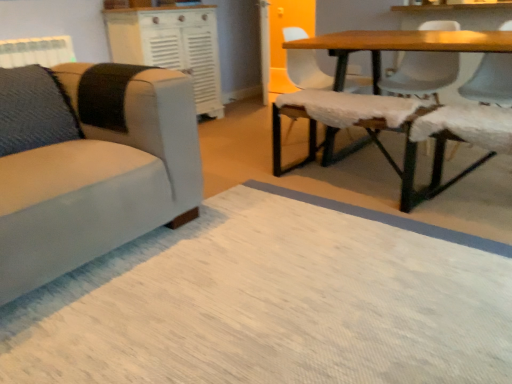
What is the approximate width of white textured radiator at upper left?

6.09 inches.

The height and width of the screenshot is (384, 512). Describe the element at coordinates (455, 140) in the screenshot. I see `fur-covered bench at lower right` at that location.

At what (x,y) coordinates should I click in order to perform the action: click on white textured cabinet at upper center. Please return your answer as a coordinate pair (x, y). Looking at the image, I should click on (170, 46).

Describe the element at coordinates (170, 46) in the screenshot. I see `white textured cabinet at upper center` at that location.

Measure the distance between wooden bench at right and camera.

The depth of wooden bench at right is 1.70 meters.

You are a GUI agent. You are given a task and a screenshot of the screen. Output one action in this format:
    pyautogui.click(x=<x>, y=<y>)
    Task: Click on the suede beige chair at left, marked as the first chair in a left-to-right arrangement
    Image resolution: width=512 pixels, height=384 pixels.
    Given the screenshot: What is the action you would take?
    pyautogui.click(x=90, y=164)

Locate an element on the screen. The height and width of the screenshot is (384, 512). smooth white chair at upper right, which is the 5th chair in left-to-right order is located at coordinates (490, 81).

This screenshot has width=512, height=384. In order to click on white textured radiator at upper left in this screenshot , I will do `click(36, 51)`.

Is white textured bench at right, which is the 3th chair in right-to-left order, positioned with its back to suede beige chair at left, placed as the 5th chair when sorted from right to left?

No.

From a real-world perspective, between white textured bench at right, which is the 3th chair in right-to-left order, and suede beige chair at left, placed as the 5th chair when sorted from right to left, who is vertically lower?

suede beige chair at left, placed as the 5th chair when sorted from right to left, from a real-world perspective.

Is white textured bench at right, which is the 3th chair in right-to-left order, bigger than suede beige chair at left, placed as the 5th chair when sorted from right to left?

No.

In order to click on chair on the left of white fabric chair at upper right, which is the 4th chair from right to left in this screenshot , I will do `click(90, 164)`.

From a real-world perspective, does suede beige chair at left, marked as the first chair in a left-to-right arrangement, stand above white fabric chair at upper right, which is the 4th chair from right to left?

Actually, suede beige chair at left, marked as the first chair in a left-to-right arrangement, is physically below white fabric chair at upper right, which is the 4th chair from right to left, in the real world.

Is suede beige chair at left, placed as the 5th chair when sorted from right to left, bigger than white fabric chair at upper right, which is the 4th chair from right to left?

Yes, suede beige chair at left, placed as the 5th chair when sorted from right to left, is bigger than white fabric chair at upper right, which is the 4th chair from right to left.

Between white textured bench at right, which is the 3th chair in right-to-left order, and fur-covered bench at lower right, which one has larger width?

Wider between the two is white textured bench at right, which is the 3th chair in right-to-left order.

Is fur-covered bench at lower right surrounded by white textured bench at right, placed as the 3th chair when sorted from left to right?

No, fur-covered bench at lower right is located outside of white textured bench at right, placed as the 3th chair when sorted from left to right.

Which is closer to the camera, [451,113] or [406,141]?

Positioned in front is point [406,141].

From a real-world perspective, relative to fur-covered bench at lower right, is white textured bench at right, placed as the 3th chair when sorted from left to right, vertically above or below?

In terms of real-world spatial position, white textured bench at right, placed as the 3th chair when sorted from left to right, is above fur-covered bench at lower right.

Considering the sizes of objects wooden bench at right and white textured bench at right, which is the 3th chair in right-to-left order, in the image provided, who is bigger, wooden bench at right or white textured bench at right, which is the 3th chair in right-to-left order,?

wooden bench at right is bigger.

Find the location of `the 4th chair above the wooden bench at right (from a real-world perspective)`. the 4th chair above the wooden bench at right (from a real-world perspective) is located at coordinates (478, 108).

Which is further, (473,116) or (484,55)?

The point (484,55) is behind.

Find the location of a particular element. This screenshot has height=384, width=512. radiator that is above the suede beige chair at left, marked as the first chair in a left-to-right arrangement (from a real-world perspective) is located at coordinates (36, 51).

From a real-world perspective, is white textured radiator at upper left physically located above or below suede beige chair at left, placed as the 5th chair when sorted from right to left?

Clearly, from a real-world perspective, white textured radiator at upper left is above suede beige chair at left, placed as the 5th chair when sorted from right to left.

Considering the relative sizes of white textured radiator at upper left and suede beige chair at left, placed as the 5th chair when sorted from right to left, in the image provided, is white textured radiator at upper left wider than suede beige chair at left, placed as the 5th chair when sorted from right to left,?

No, white textured radiator at upper left is not wider than suede beige chair at left, placed as the 5th chair when sorted from right to left.

In terms of width, does white textured cabinet at upper center look wider or thinner when compared to wooden bench at right?

Considering their sizes, white textured cabinet at upper center looks slimmer than wooden bench at right.

From a real-world perspective, is white textured cabinet at upper center positioned above or below wooden bench at right?

white textured cabinet at upper center is above wooden bench at right.

This screenshot has width=512, height=384. I want to click on dresser on the left of wooden bench at right, so click(x=170, y=46).

From a real-world perspective, is fuzzy fabric swivel chair at center over suede beige chair at left, placed as the 5th chair when sorted from right to left?

Actually, fuzzy fabric swivel chair at center is physically below suede beige chair at left, placed as the 5th chair when sorted from right to left, in the real world.

Would you say fuzzy fabric swivel chair at center contains suede beige chair at left, marked as the first chair in a left-to-right arrangement?

No, suede beige chair at left, marked as the first chair in a left-to-right arrangement, is not inside fuzzy fabric swivel chair at center.

Where is `swivel chair lying behind the suede beige chair at left, placed as the 5th chair when sorted from right to left`? This screenshot has height=384, width=512. swivel chair lying behind the suede beige chair at left, placed as the 5th chair when sorted from right to left is located at coordinates (331, 116).

Find the location of a particular element. This screenshot has height=384, width=512. the 2nd chair counting from the right side of the suede beige chair at left, placed as the 5th chair when sorted from right to left is located at coordinates (478, 108).

In order to click on chair that is the 2nd object above the suede beige chair at left, marked as the first chair in a left-to-right arrangement (from a real-world perspective) in this screenshot , I will do `click(306, 70)`.

From the image, which object appears to be nearer to white fabric chair at upper right, the second chair positioned from the right, white fabric chair at upper right, which is the 4th chair from right to left, or white textured cabinet at upper center?

Among the two, white fabric chair at upper right, which is the 4th chair from right to left, is located nearer to white fabric chair at upper right, the second chair positioned from the right.

Considering their positions, is white textured bench at right, placed as the 3th chair when sorted from left to right, positioned closer to white fabric chair at upper right, the second chair positioned from the right, than white textured cabinet at upper center?

Among the two, white textured bench at right, placed as the 3th chair when sorted from left to right, is located nearer to white fabric chair at upper right, the second chair positioned from the right.

When comparing their distances from fuzzy fabric swivel chair at center, does white textured cabinet at upper center or wooden bench at right seem further?

white textured cabinet at upper center lies further to fuzzy fabric swivel chair at center than the other object.

Based on the photo, estimate the real-world distances between objects in this image. Which object is closer to white textured bench at right, placed as the 3th chair when sorted from left to right, white textured radiator at upper left or wooden bench at right?

Based on the image, wooden bench at right appears to be nearer to white textured bench at right, placed as the 3th chair when sorted from left to right.

When comparing their distances from white fabric chair at upper right, which is the 4th chair from right to left, does white textured cabinet at upper center or fur-covered bench at lower right seem further?

fur-covered bench at lower right is positioned further to the anchor white fabric chair at upper right, which is the 4th chair from right to left.

Which object lies nearer to the anchor point fur-covered bench at lower right, smooth white chair at upper right, which is the 5th chair in left-to-right order, or white textured cabinet at upper center?

Based on the image, smooth white chair at upper right, which is the 5th chair in left-to-right order, appears to be nearer to fur-covered bench at lower right.

Based on their spatial positions, is white textured cabinet at upper center or fuzzy fabric swivel chair at center closer to white fabric chair at upper right, which is the 4th chair from right to left?

The object closer to white fabric chair at upper right, which is the 4th chair from right to left, is fuzzy fabric swivel chair at center.

From the image, which object appears to be farther from white fabric chair at upper right, the fourth chair from the left, wooden bench at right or white fabric chair at upper right, which appears as the 2th chair when viewed from the left?

wooden bench at right is further to white fabric chair at upper right, the fourth chair from the left.

At what (x,y) coordinates should I click in order to perform the action: click on swivel chair between white textured cabinet at upper center and fur-covered bench at lower right in the horizontal direction. Please return your answer as a coordinate pair (x, y). This screenshot has width=512, height=384. Looking at the image, I should click on (331, 116).

The width and height of the screenshot is (512, 384). I want to click on chair between fuzzy fabric swivel chair at center and fur-covered bench at lower right, so click(478, 108).

I want to click on swivel chair between suede beige chair at left, placed as the 5th chair when sorted from right to left, and wooden bench at right, in the horizontal direction, so click(331, 116).

The height and width of the screenshot is (384, 512). Identify the location of table between white textured cabinet at upper center and white textured bench at right, placed as the 3th chair when sorted from left to right, from left to right. (399, 106).